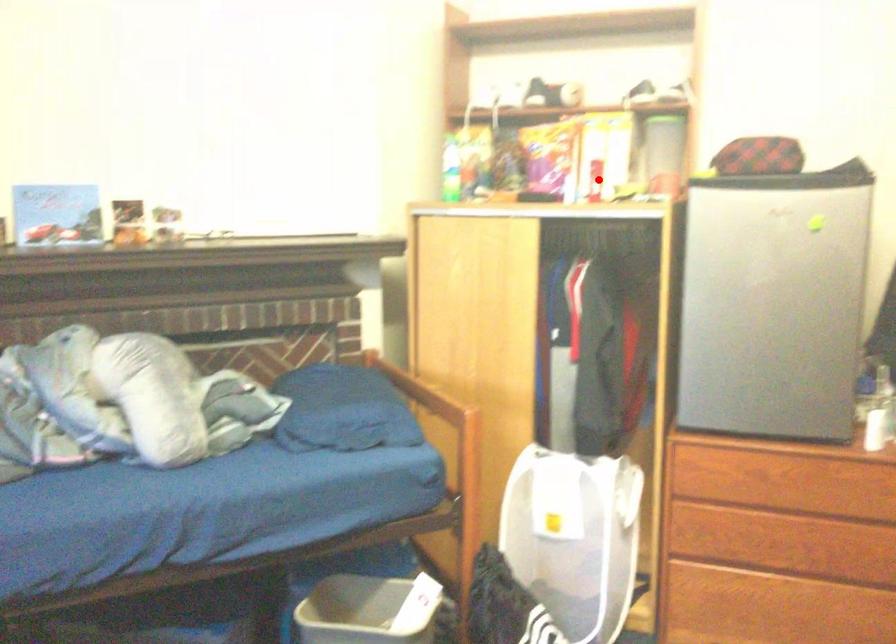
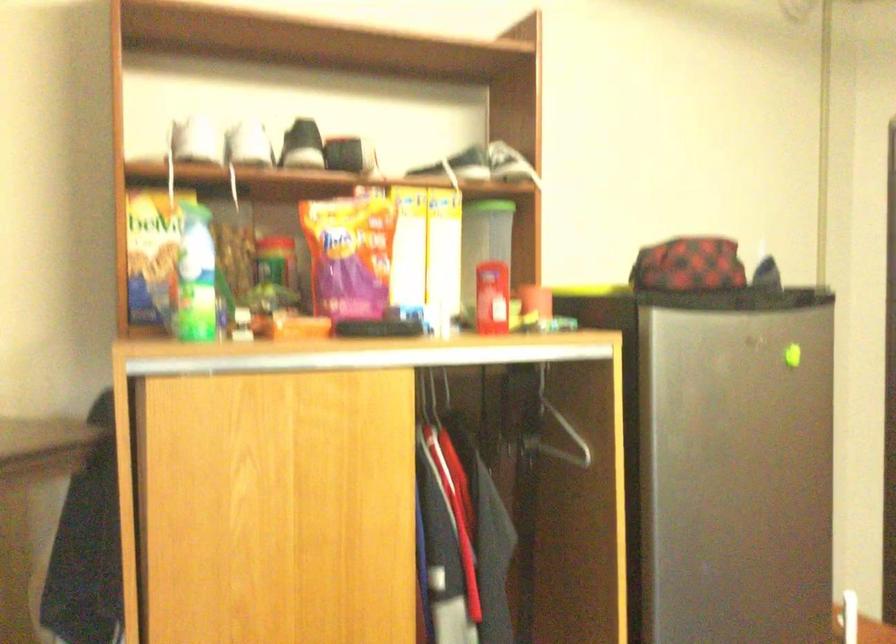
Question: I am providing you with two images of the same scene from different viewpoints. In image1, a red point is highlighted. Considering the same 3D point in image2, which of the following is correct?

Choices:
 (A) It is closer
 (B) It is farther

Answer: (A)